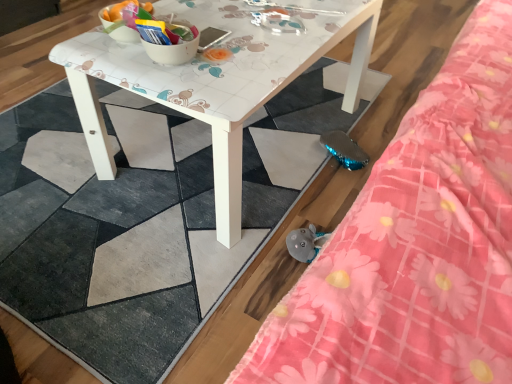
Where is `pink floral fabric at upper right`? The width and height of the screenshot is (512, 384). pink floral fabric at upper right is located at coordinates (416, 244).

In order to face pink floral fabric at upper right, should I rotate leftwards or rightwards?

To face it directly, rotate right by 26.791 degrees.

What do you see at coordinates (416, 244) in the screenshot? This screenshot has height=384, width=512. I see `pink floral fabric at upper right` at bounding box center [416, 244].

What do you see at coordinates (216, 79) in the screenshot? I see `white glossy table at center` at bounding box center [216, 79].

I want to click on white glossy table at center, so point(216,79).

You are a GUI agent. You are given a task and a screenshot of the screen. Output one action in this format:
    pyautogui.click(x=<x>, y=<y>)
    Task: Click on the pink floral fabric at upper right
    
    Given the screenshot: What is the action you would take?
    pyautogui.click(x=416, y=244)

Would you say white glossy table at center is to the left or to the right of pink floral fabric at upper right in the picture?

white glossy table at center is positioned on pink floral fabric at upper right's left side.

Which object is more forward, white glossy table at center or pink floral fabric at upper right?

pink floral fabric at upper right is in front.

Does point (119, 47) come behind point (475, 129)?

Yes, point (119, 47) is behind point (475, 129).

From the image's perspective, would you say white glossy table at center is shown under pink floral fabric at upper right?

No, from the image's perspective, white glossy table at center is not beneath pink floral fabric at upper right.

From a real-world perspective, is white glossy table at center on pink floral fabric at upper right?

Actually, white glossy table at center is physically below pink floral fabric at upper right in the real world.

Can you confirm if white glossy table at center is wider than pink floral fabric at upper right?

Yes, white glossy table at center is wider than pink floral fabric at upper right.

Considering the relative sizes of white glossy table at center and pink floral fabric at upper right in the image provided, is white glossy table at center taller than pink floral fabric at upper right?

In fact, white glossy table at center may be shorter than pink floral fabric at upper right.

Is white glossy table at center bigger than pink floral fabric at upper right?

Yes, white glossy table at center is bigger than pink floral fabric at upper right.

Is white glossy table at center outside of pink floral fabric at upper right?

Indeed, white glossy table at center is completely outside pink floral fabric at upper right.

Is white glossy table at center placed right next to pink floral fabric at upper right?

No, white glossy table at center is not making contact with pink floral fabric at upper right.

From the picture: Could you tell me if white glossy table at center is facing pink floral fabric at upper right?

No, white glossy table at center does not turn towards pink floral fabric at upper right.

Find the location of a particular element. This screenshot has height=384, width=512. bed in front of the white glossy table at center is located at coordinates (416, 244).

Does pink floral fabric at upper right appear on the right side of white glossy table at center?

Indeed, pink floral fabric at upper right is positioned on the right side of white glossy table at center.

Is pink floral fabric at upper right in front of white glossy table at center?

Yes, pink floral fabric at upper right is in front of white glossy table at center.

Which point is more distant from viewer, (478, 338) or (204, 57)?

The point (204, 57) is more distant.

From the image's perspective, which one is positioned lower, pink floral fabric at upper right or white glossy table at center?

From the image's view, pink floral fabric at upper right is below.

From a real-world perspective, is pink floral fabric at upper right located higher than white glossy table at center?

Indeed, from a real-world perspective, pink floral fabric at upper right stands above white glossy table at center.

Is pink floral fabric at upper right wider or thinner than white glossy table at center?

Clearly, pink floral fabric at upper right has less width compared to white glossy table at center.

Does pink floral fabric at upper right have a greater height compared to white glossy table at center?

Yes, pink floral fabric at upper right is taller than white glossy table at center.

Is pink floral fabric at upper right bigger or smaller than white glossy table at center?

Considering their sizes, pink floral fabric at upper right takes up less space than white glossy table at center.

Would you say pink floral fabric at upper right is outside white glossy table at center?

Indeed, pink floral fabric at upper right is completely outside white glossy table at center.

Is pink floral fabric at upper right in contact with white glossy table at center?

No, pink floral fabric at upper right is not with white glossy table at center.

Is pink floral fabric at upper right oriented away from white glossy table at center?

No.

Can you tell me how much pink floral fabric at upper right and white glossy table at center differ in facing direction?

The angle between the facing direction of pink floral fabric at upper right and the facing direction of white glossy table at center is 90 degrees.

How far apart are pink floral fabric at upper right and white glossy table at center?

18.31 inches.

This screenshot has width=512, height=384. Find the location of `table lying behind the pink floral fabric at upper right`. table lying behind the pink floral fabric at upper right is located at coordinates (216, 79).

What are the coordinates of `table beneath the pink floral fabric at upper right (from a real-world perspective)` in the screenshot? It's located at (216, 79).

The width and height of the screenshot is (512, 384). What are the coordinates of `bed to the right of white glossy table at center` in the screenshot? It's located at (416, 244).